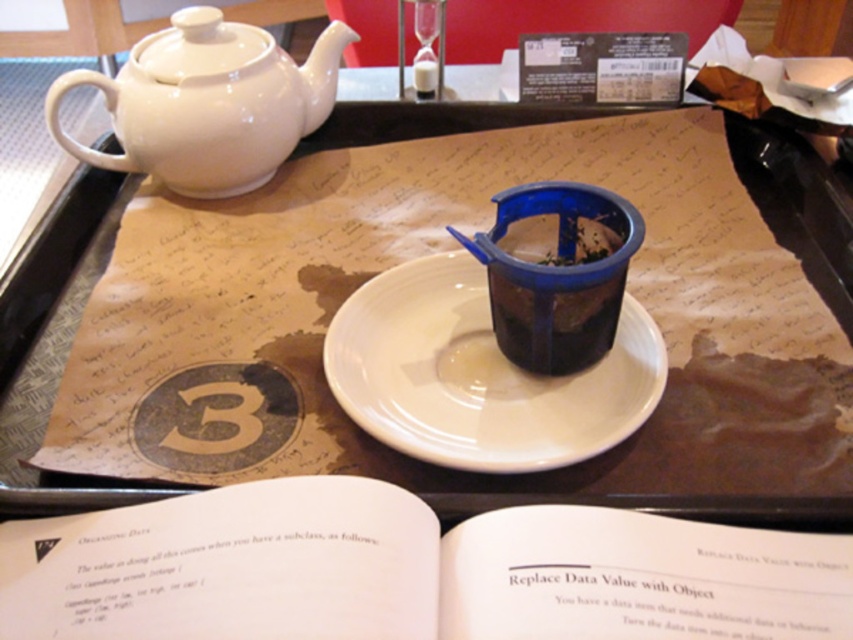
Question: Which object is positioned closest to the blue plastic tea bag at center?

Choices:
 (A) matte plastic cup at center
 (B) white paper book at center

Answer: (A)

Question: Which of the following is the closest to the observer?

Choices:
 (A) white paper book at center
 (B) matte plastic cup at center

Answer: (A)

Question: Can you confirm if white paper book at center is wider than white glossy teapot at upper left?

Choices:
 (A) yes
 (B) no

Answer: (A)

Question: Which point is farther to the camera?

Choices:
 (A) (641, 330)
 (B) (462, 244)
 (C) (45, 564)

Answer: (A)

Question: Does white paper book at center have a larger size compared to blue plastic tea bag at center?

Choices:
 (A) no
 (B) yes

Answer: (B)

Question: Is white ceramic saucer at center thinner than white glossy teapot at upper left?

Choices:
 (A) yes
 (B) no

Answer: (A)